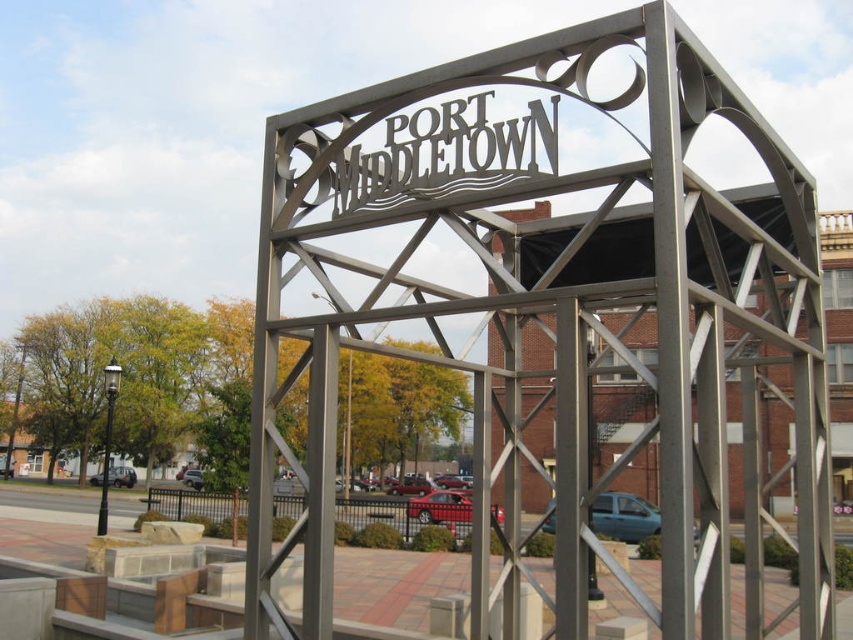
You are a photographer standing in front of the metal archway with the inscription. You want to capture a photo that includes both the metallic red car at center and the matte black sedan at lower left. Which car should you focus on first to ensure both are in frame?

The metallic red car at center is positioned over matte black sedan at lower left, so you should focus on the metallic red car at center first to ensure both are in frame.

You are a photographer standing in front of the PORT MIDDLETOWN archway. You want to capture a photo that includes both the metallic sign at center and the teal metallic car at center. Based on their positions, which object should appear higher in your photo?

The metallic sign at center is above the teal metallic car at center, so it will appear higher in the photo.